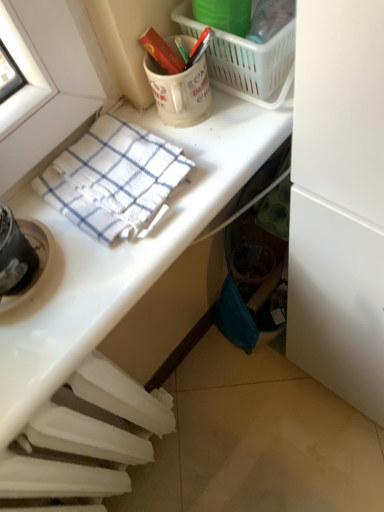
I want to click on vacant area that lies in front of white matte coffee cup at upper center, so click(203, 165).